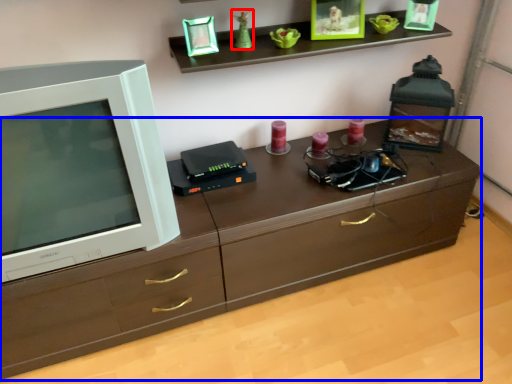
Question: Which point is further to the camera, toy (highlighted by a red box) or chest of drawers (highlighted by a blue box)?

Choices:
 (A) toy
 (B) chest of drawers

Answer: (A)